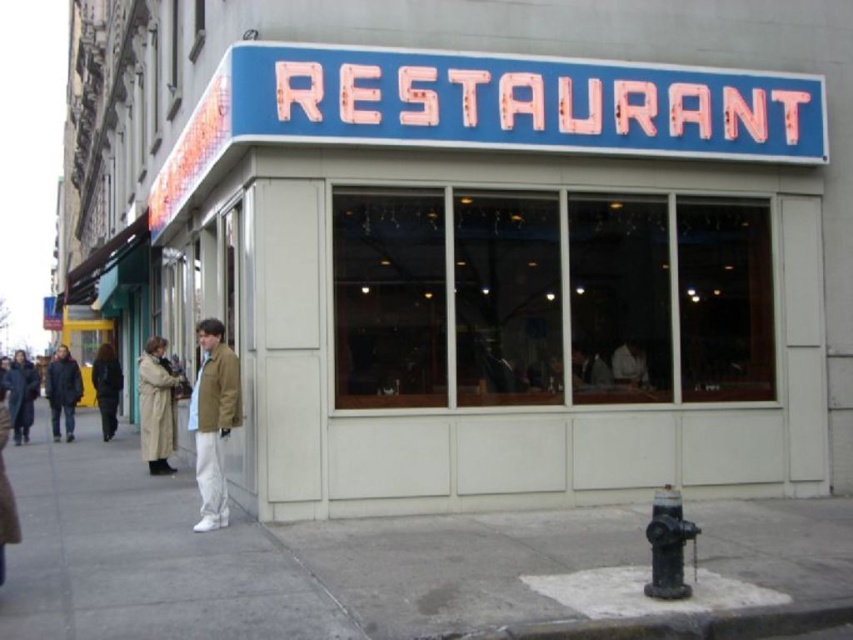
You are standing directly in front of the restaurant. A small drone is hovering at point (820, 147). If you want to take a photo of the drone without any obstructions, which direction should you move? Please answer with either left, right, forward, or backward.

The point (820, 147) is 9.07 meters away from the viewer. Since you are standing directly in front of the restaurant, moving forward would bring you closer to the drone, but since the drone is already 9.07 meters away, moving forward might not be necessary. However, to ensure no obstructions like the restaurant facade or windows block the view, moving backward could provide a clearer line of sight. Alternatively, moving left or right might adjust the angle to avoid any potential obstructions from the sign

You are standing at the entrance of the restaurant and want to hang a new menu board between the blue painted signboard at upper center and the tan leather jacket at center. The menu board is 2 meters wide. Is there enough space to place it without overlapping either object?

The distance between the blue painted signboard at upper center and the tan leather jacket at center is 4.80 meters. Since the menu board is only 2 meters wide, there is sufficient space to place it between them without overlapping either object.